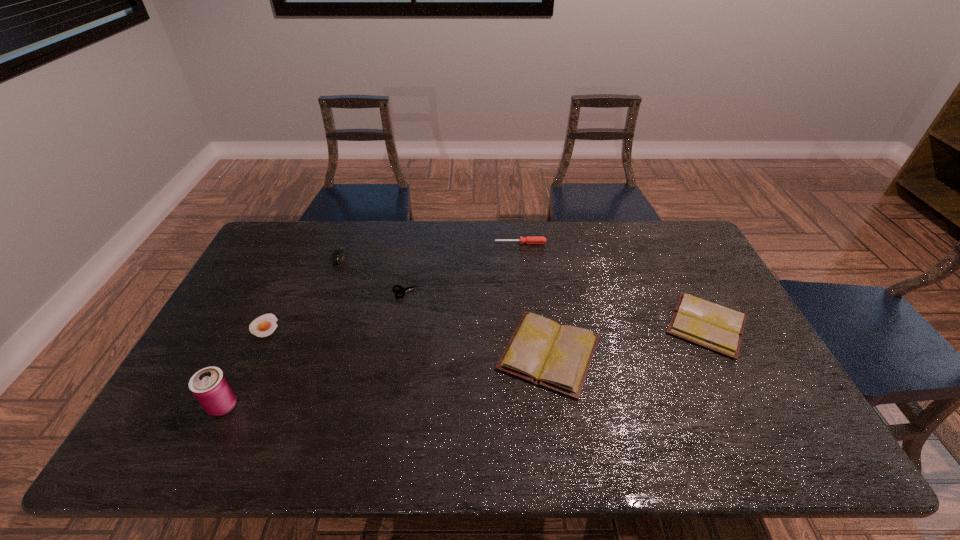
What are the coordinates of `unoccupied area between the shortest object and the can` in the screenshot? It's located at tap(244, 366).

This screenshot has height=540, width=960. I want to click on free space between the egg yolk and the farthest object, so point(393,285).

Select which object appears as the closest to the shears. Please provide its 2D coordinates. Your answer should be formatted as a tuple, i.e. [(x, y)], where the tuple contains the x and y coordinates of a point satisfying the conditions above.

[(340, 254)]

At what (x,y) coordinates should I click in order to perform the action: click on the fifth closest object to the fourth object from left to right. Please return your answer as a coordinate pair (x, y). Looking at the image, I should click on (210, 386).

Locate an element on the screen. The width and height of the screenshot is (960, 540). vacant region that satisfies the following two spatial constraints: 1. on the wheel side of the second farthest object; 2. on the right side of the fourth object from right to left is located at coordinates pos(327,293).

The width and height of the screenshot is (960, 540). Identify the location of free space in the image that satisfies the following two spatial constraints: 1. on the wheel side of the second farthest object; 2. on the left side of the second shortest object. coord(327,293).